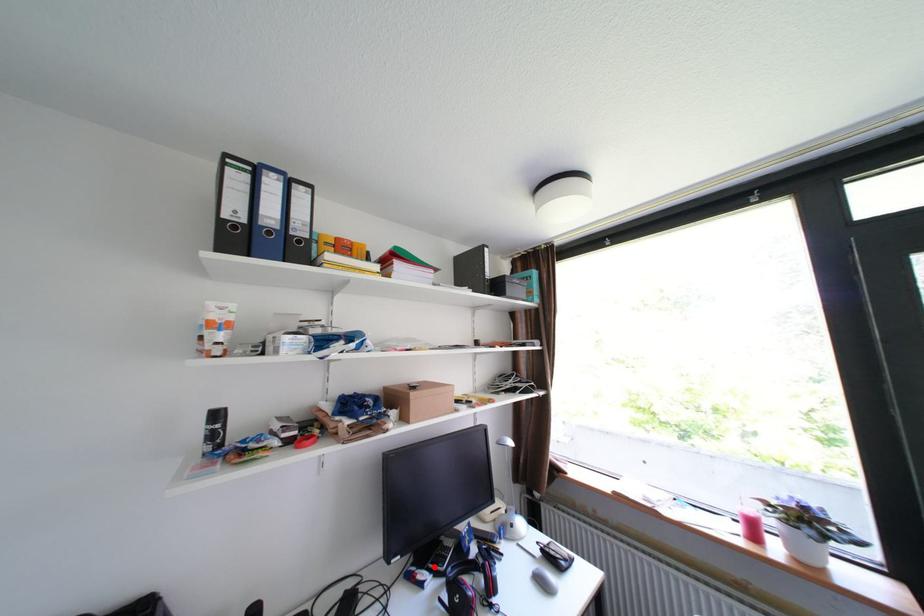
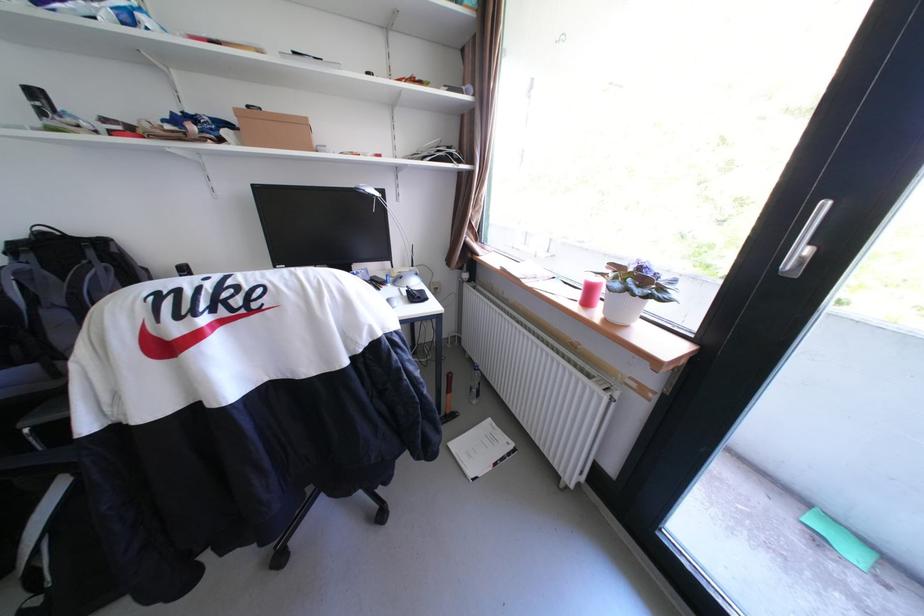
Question: I am providing you with two images of the same scene from different viewpoints. A red point is marked on the first image. At the location where the point appears in image 1, is it still visible in image 2?

Choices:
 (A) Yes
 (B) No

Answer: (B)